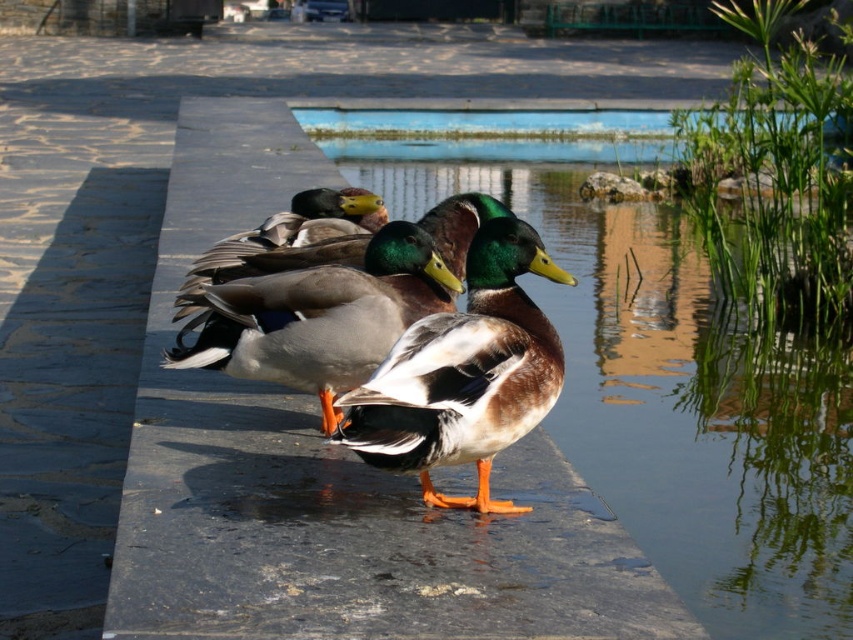
Is point (190, 381) less distant than point (618, 109)?

Yes, it is.

Is point (294, 122) closer to camera compared to point (581, 136)?

Yes, point (294, 122) is closer to viewer.

This screenshot has height=640, width=853. Identify the location of smooth stone ledge at center. (335, 467).

Is brown glossy duck at center shorter than blue concrete pool at center?

Correct, brown glossy duck at center is not as tall as blue concrete pool at center.

Where is `brown glossy duck at center`? Image resolution: width=853 pixels, height=640 pixels. brown glossy duck at center is located at coordinates (322, 317).

Can you confirm if shiny brown duck at center is shorter than brown glossy duck at center?

No.

Between point (538, 396) and point (419, 305), which one is positioned in front?

Point (538, 396)

The image size is (853, 640). What are the coordinates of `shiny brown duck at center` in the screenshot? It's located at (463, 372).